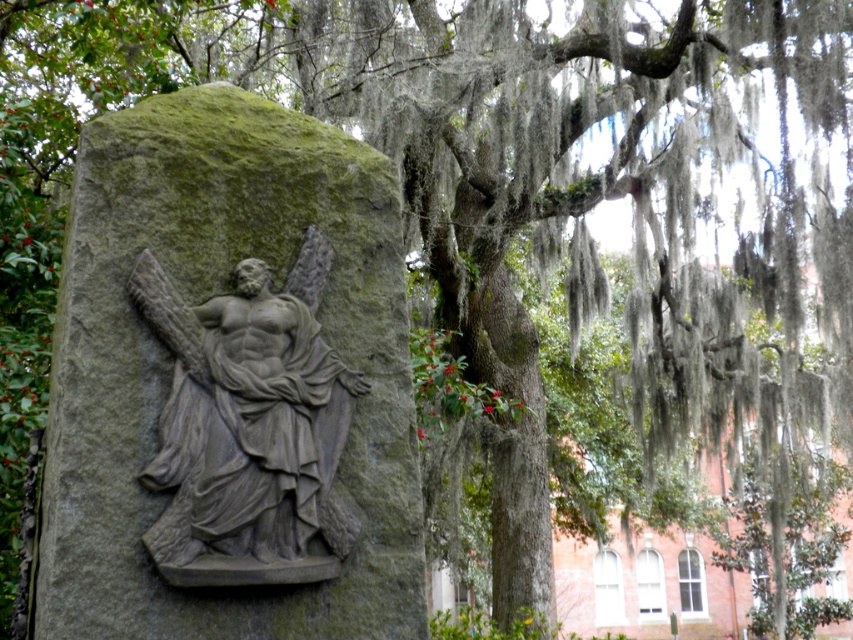
Between gray stone carving at center and gray stone sculpture at center, which one appears on the left side from the viewer's perspective?

gray stone carving at center

Between gray stone carving at center and gray stone sculpture at center, which one has more height?

gray stone carving at center is taller.

You are a GUI agent. You are given a task and a screenshot of the screen. Output one action in this format:
    pyautogui.click(x=<x>, y=<y>)
    Task: Click on the gray stone carving at center
    
    Given the screenshot: What is the action you would take?
    pyautogui.click(x=229, y=381)